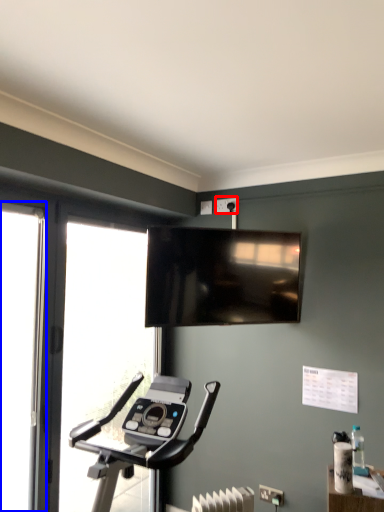
Question: Which point is closer to the camera, electric outlet (highlighted by a red box) or screen door (highlighted by a blue box)?

Choices:
 (A) electric outlet
 (B) screen door

Answer: (B)